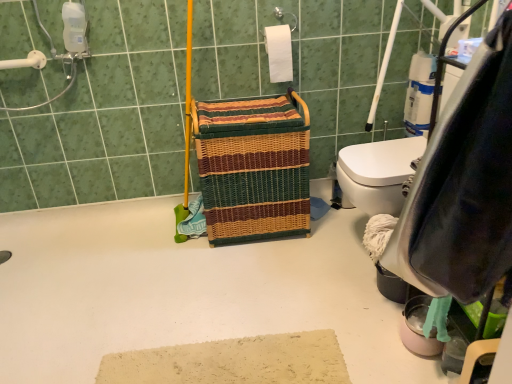
Question: Is woven multicolored laundry basket at center in front of or behind white plastic grab bar at upper left in the image?

Choices:
 (A) behind
 (B) front

Answer: (B)

Question: Considering the positions of woven multicolored laundry basket at center and white plastic grab bar at upper left in the image, is woven multicolored laundry basket at center taller or shorter than white plastic grab bar at upper left?

Choices:
 (A) short
 (B) tall

Answer: (B)

Question: Which is farther from the white matte toilet paper at upper center?

Choices:
 (A) white plastic grab bar at upper left
 (B) woven multicolored laundry basket at center

Answer: (A)

Question: Estimate the real-world distances between objects in this image. Which object is farther from the white plastic grab bar at upper left?

Choices:
 (A) woven multicolored laundry basket at center
 (B) white matte toilet paper at upper center

Answer: (B)